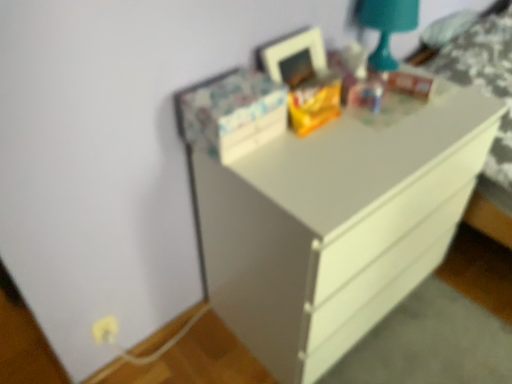
Question: In terms of height, does teal glossy lamp at upper right look taller or shorter compared to white glossy chest of drawers at center?

Choices:
 (A) tall
 (B) short

Answer: (B)

Question: Relative to white glossy chest of drawers at center, is teal glossy lamp at upper right in front or behind?

Choices:
 (A) behind
 (B) front

Answer: (A)

Question: In terms of width, does teal glossy lamp at upper right look wider or thinner when compared to white glossy chest of drawers at center?

Choices:
 (A) wide
 (B) thin

Answer: (B)

Question: Is white glossy chest of drawers at center wider or thinner than teal glossy lamp at upper right?

Choices:
 (A) wide
 (B) thin

Answer: (A)

Question: From the image's perspective, is white glossy chest of drawers at center above or below teal glossy lamp at upper right?

Choices:
 (A) above
 (B) below

Answer: (B)

Question: Considering the positions of white glossy chest of drawers at center and teal glossy lamp at upper right in the image, is white glossy chest of drawers at center taller or shorter than teal glossy lamp at upper right?

Choices:
 (A) short
 (B) tall

Answer: (B)

Question: Based on their sizes in the image, would you say white glossy chest of drawers at center is bigger or smaller than teal glossy lamp at upper right?

Choices:
 (A) small
 (B) big

Answer: (B)